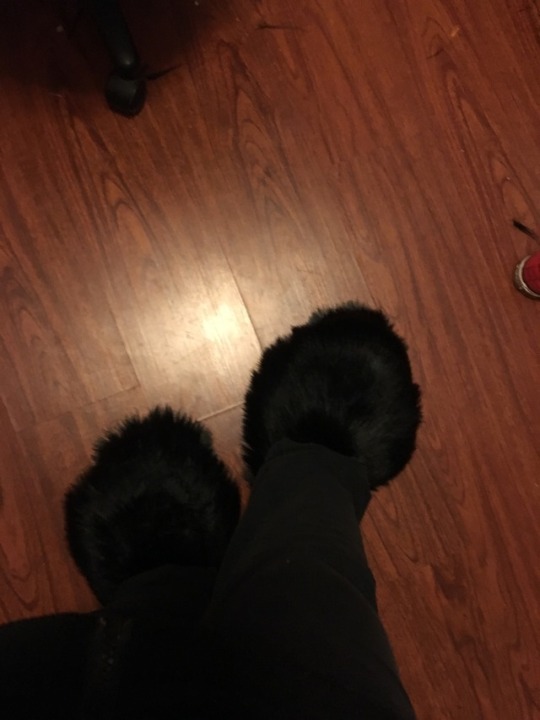
Where is `wood floor, brown`? wood floor, brown is located at coordinates (96, 354).